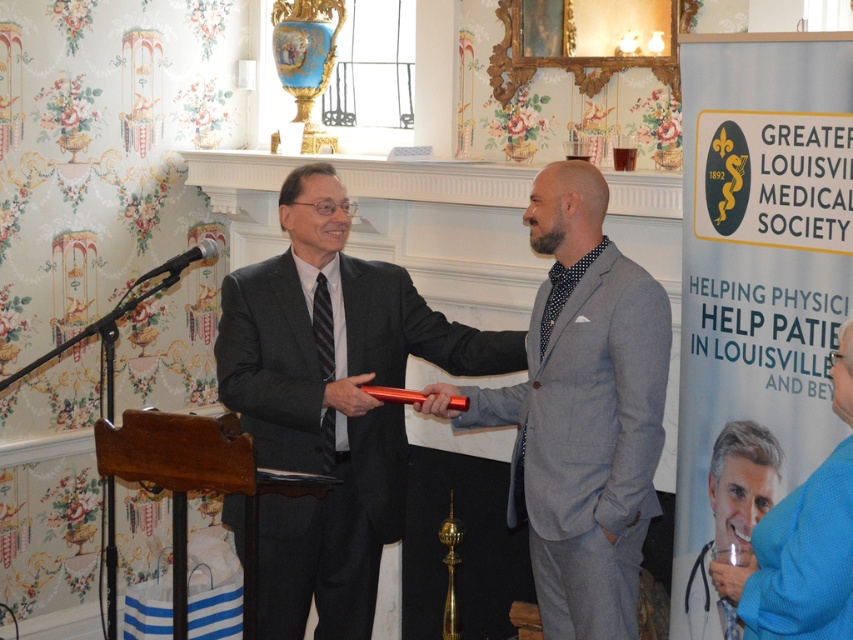
Which is more to the right, gray wool suit at center or metallic silver microphone at left?

From the viewer's perspective, gray wool suit at center appears more on the right side.

Between gray wool suit at center and metallic silver microphone at left, which one is positioned higher?

Positioned higher is metallic silver microphone at left.

Which is in front, point (596, 236) or point (209, 257)?

Point (596, 236) is in front.

Where is `gray wool suit at center`? gray wool suit at center is located at coordinates (581, 412).

Is matte black suit at center positioned behind blue fabric shirt at lower right?

That is True.

Does matte black suit at center appear on the left side of blue fabric shirt at lower right?

Correct, you'll find matte black suit at center to the left of blue fabric shirt at lower right.

Locate an element on the screen. matte black suit at center is located at coordinates (331, 401).

This screenshot has height=640, width=853. What are the coordinates of `matte black suit at center` in the screenshot? It's located at (331, 401).

Who is taller, matte black suit at center or metallic silver microphone at left?

Standing taller between the two is matte black suit at center.

Between matte black suit at center and metallic silver microphone at left, which one is positioned lower?

matte black suit at center is below.

Which is behind, point (389, 324) or point (161, 268)?

Point (389, 324)

At what (x,y) coordinates should I click in order to perform the action: click on matte black suit at center. Please return your answer as a coordinate pair (x, y). The width and height of the screenshot is (853, 640). Looking at the image, I should click on (331, 401).